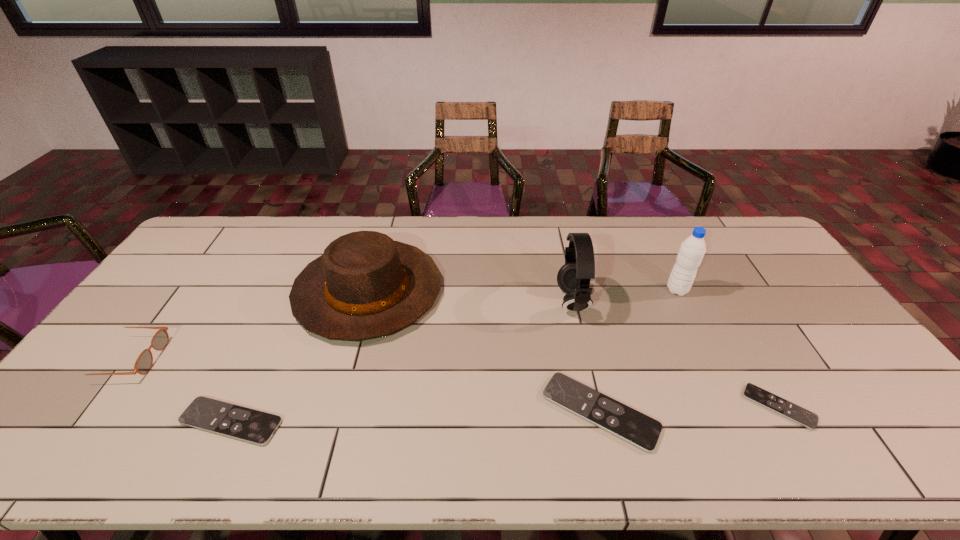
Where is `vacant position in the image that satisfies the following two spatial constraints: 1. on the front-facing side of the shortest object; 2. on the right side of the sunglasses`? vacant position in the image that satisfies the following two spatial constraints: 1. on the front-facing side of the shortest object; 2. on the right side of the sunglasses is located at coordinates (92, 407).

Where is `vacant space that satisfies the following two spatial constraints: 1. on the ear cups of the earphone; 2. on the back side of the second remote control from right to left`? vacant space that satisfies the following two spatial constraints: 1. on the ear cups of the earphone; 2. on the back side of the second remote control from right to left is located at coordinates (597, 411).

I want to click on vacant point that satisfies the following two spatial constraints: 1. on the ear cups of the shortest object; 2. on the right side of the earphone, so click(596, 407).

The image size is (960, 540). What are the coordinates of `free point that satisfies the following two spatial constraints: 1. on the front-facing side of the leftmost object; 2. on the left side of the shortest remote control` in the screenshot? It's located at (92, 407).